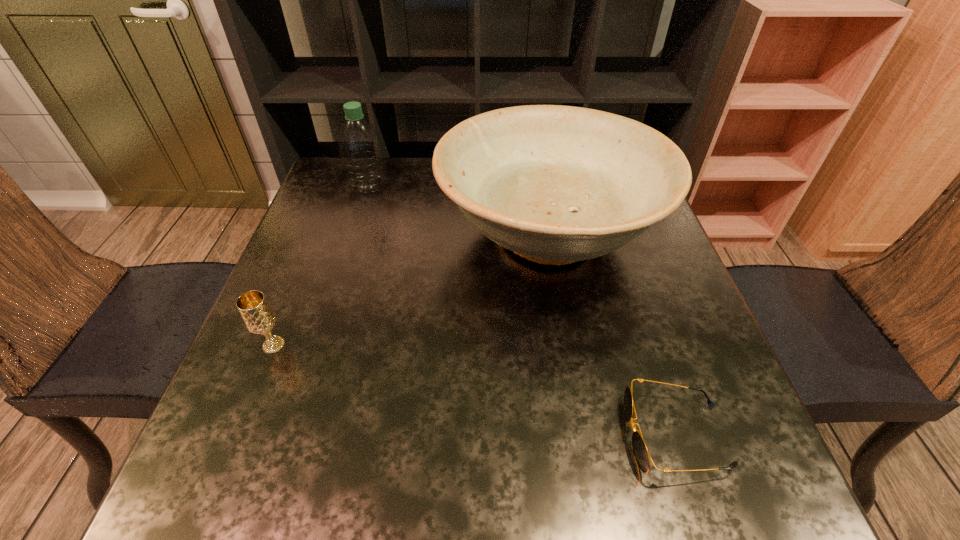
Identify the location of vacant space located on the front-facing side of the sunglasses. The width and height of the screenshot is (960, 540). (528, 435).

This screenshot has height=540, width=960. I want to click on vacant point located 0.190m on the front-facing side of the sunglasses, so click(x=509, y=435).

You are a GUI agent. You are given a task and a screenshot of the screen. Output one action in this format:
    pyautogui.click(x=<x>, y=<y>)
    Task: Click on the water bottle located at the far edge
    
    Given the screenshot: What is the action you would take?
    pyautogui.click(x=359, y=144)

Find the location of a particular element. This screenshot has height=540, width=960. dish present at the far edge is located at coordinates (555, 184).

This screenshot has height=540, width=960. Identify the location of object at the near edge. (642, 456).

Where is `water bottle present at the left edge`? The width and height of the screenshot is (960, 540). water bottle present at the left edge is located at coordinates (359, 144).

Where is `chalice positioned at the left edge`? The height and width of the screenshot is (540, 960). chalice positioned at the left edge is located at coordinates (259, 318).

Where is `dish located in the right edge section of the desktop`? dish located in the right edge section of the desktop is located at coordinates (555, 184).

Where is `sunglasses that is at the right edge`? This screenshot has width=960, height=540. sunglasses that is at the right edge is located at coordinates (642, 456).

This screenshot has width=960, height=540. I want to click on object at the far left corner, so click(x=359, y=144).